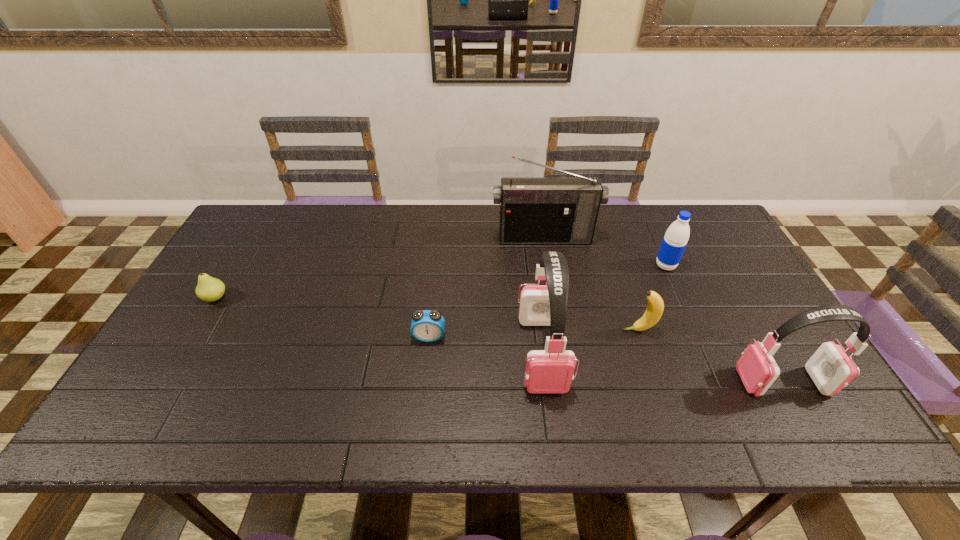
Identify the location of vacant region located on the outer surface of the right earphone. This screenshot has height=540, width=960. (719, 382).

This screenshot has width=960, height=540. I want to click on vacant area located 0.400m on the outer surface of the right earphone, so click(x=571, y=382).

Where is `free space located 0.320m on the outer surface of the right earphone`? The height and width of the screenshot is (540, 960). free space located 0.320m on the outer surface of the right earphone is located at coordinates (605, 382).

Where is `vacant space situated on the front-facing side of the farthest object`? vacant space situated on the front-facing side of the farthest object is located at coordinates (553, 288).

The width and height of the screenshot is (960, 540). Identify the location of free space located 0.230m on the back of the sixth object from left to right. (643, 214).

Find the location of `free location located 0.140m from the stem of the fifth tallest object`. free location located 0.140m from the stem of the fifth tallest object is located at coordinates (569, 330).

This screenshot has height=540, width=960. Find the location of `free space located 0.240m from the stem of the fifth tallest object`. free space located 0.240m from the stem of the fifth tallest object is located at coordinates (531, 330).

Image resolution: width=960 pixels, height=540 pixels. In order to click on vacant region located from the stem of the fifth tallest object in this screenshot , I will do `click(523, 330)`.

The image size is (960, 540). Identify the location of blank space located on the face of the alarm clock. (422, 399).

Identify the location of vacant space located 0.230m on the right of the fifth nearest object. (310, 298).